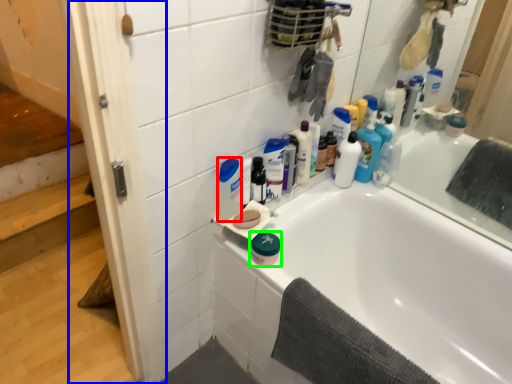
Question: Which is nearer to the cleaning product (highlighted by a red box)? screen door (highlighted by a blue box) or product (highlighted by a green box).

Choices:
 (A) screen door
 (B) product

Answer: (B)